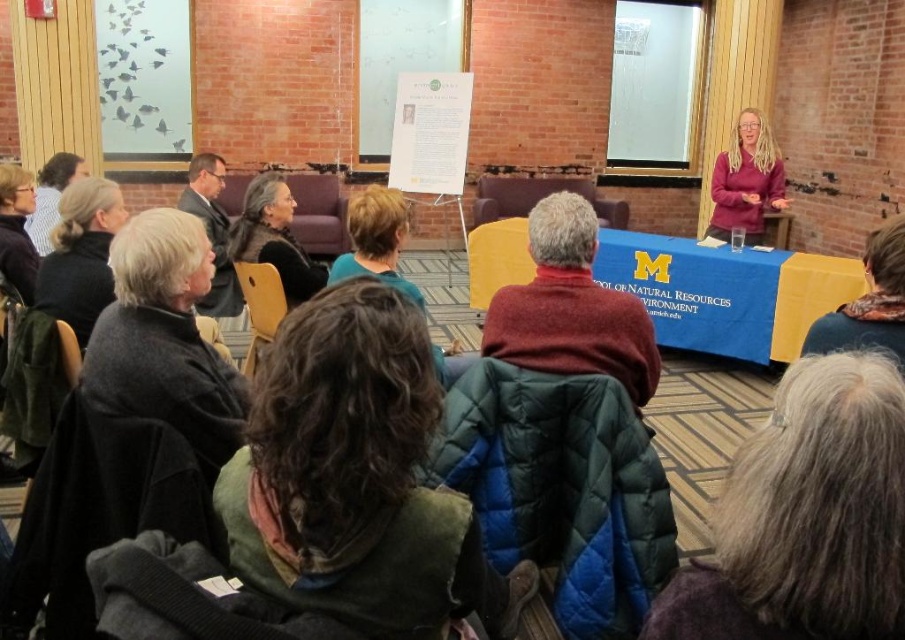
Question: Considering the real-world distances, which object is closest to the maroon sweater at center?

Choices:
 (A) matte black jacket at left
 (B) matte black suit at left

Answer: (A)

Question: Is gray woolen scarf at lower right to the left of dark gray sweater at left from the viewer's perspective?

Choices:
 (A) no
 (B) yes

Answer: (A)

Question: Which object appears farthest from the camera in this image?

Choices:
 (A) dark gray wool coat at left
 (B) matte black suit at left

Answer: (B)

Question: Which point is farther to the camera?

Choices:
 (A) (642, 364)
 (B) (849, 344)
 (C) (368, 509)

Answer: (A)

Question: Is maroon sweater at center bigger than matte purple sweater at upper right?

Choices:
 (A) yes
 (B) no

Answer: (B)

Question: Considering the relative positions of dark gray wool coat at left and blue striped shirt at left in the image provided, where is dark gray wool coat at left located with respect to blue striped shirt at left?

Choices:
 (A) left
 (B) right

Answer: (B)